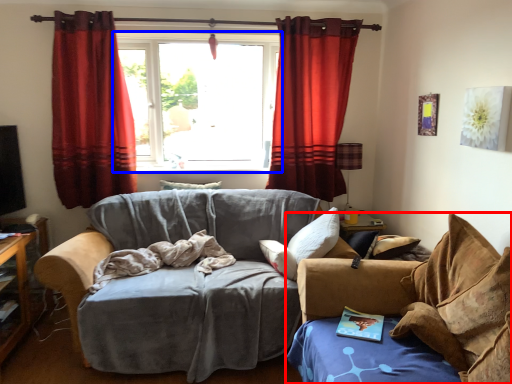
Question: Which object is further to the camera taking this photo, studio couch (highlighted by a red box) or window (highlighted by a blue box)?

Choices:
 (A) studio couch
 (B) window

Answer: (B)